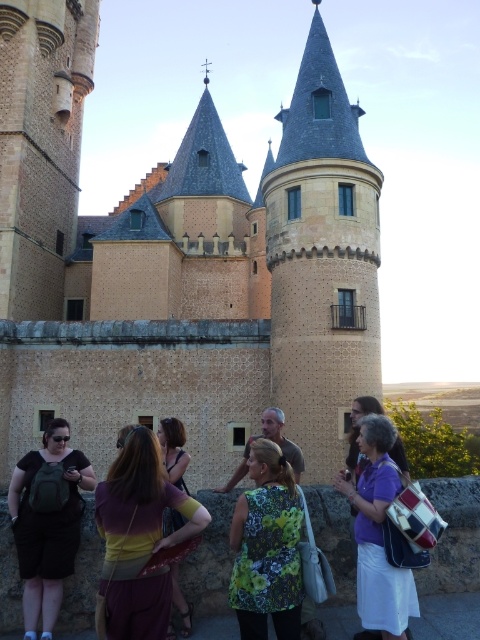
Is brick stonework tower at center to the right of floral dress at center from the viewer's perspective?

Yes, brick stonework tower at center is to the right of floral dress at center.

Can you confirm if brick stonework tower at center is wider than floral dress at center?

Indeed, brick stonework tower at center has a greater width compared to floral dress at center.

This screenshot has width=480, height=640. Find the location of `brick stonework tower at center`. brick stonework tower at center is located at coordinates (322, 259).

Image resolution: width=480 pixels, height=640 pixels. In order to click on brick stonework tower at center in this screenshot , I will do `click(322, 259)`.

Does maroon fabric dress at center have a lesser width compared to floral dress at center?

No, maroon fabric dress at center is not thinner than floral dress at center.

This screenshot has width=480, height=640. Identify the location of maroon fabric dress at center. (137, 538).

Is floral fabric vest at center to the left of purple fabric purse at center from the viewer's perspective?

Correct, you'll find floral fabric vest at center to the left of purple fabric purse at center.

Can you confirm if floral fabric vest at center is thinner than purple fabric purse at center?

In fact, floral fabric vest at center might be wider than purple fabric purse at center.

Between point (294, 618) and point (372, 538), which one is positioned behind?

Positioned behind is point (372, 538).

This screenshot has height=640, width=480. I want to click on floral fabric vest at center, so click(x=266, y=547).